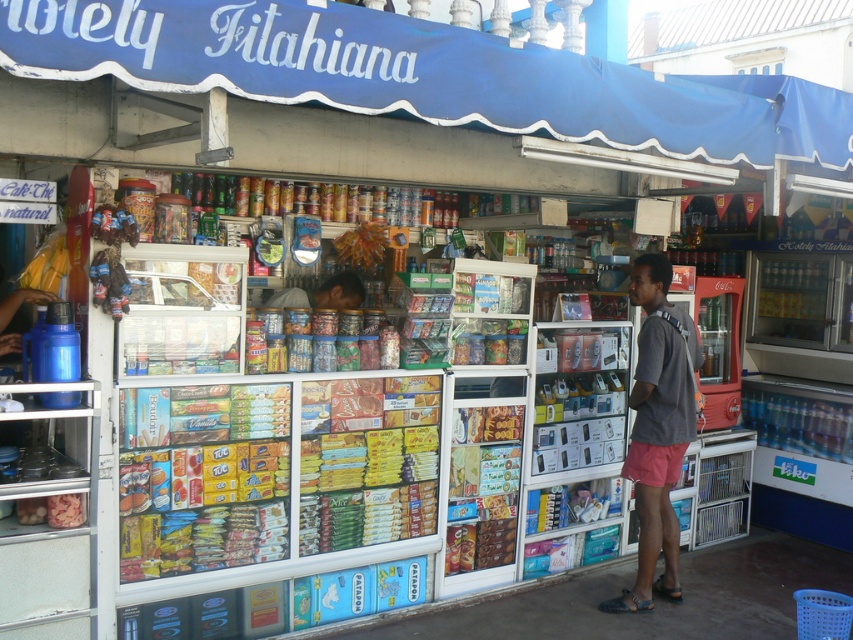
You are a customer at the Fitahiana street stall and you see the gray fabric shirt at center and the matte brown bag at center. Which object is taller?

The gray fabric shirt at center is taller than the matte brown bag at center.

You are a customer at the Fitahiana street stall and want to place your matte brown bag at center next to your gray fabric shirt at center. Since both items are at the center, which one will you have to move to make space?

Since the gray fabric shirt at center is wider than the matte brown bag at center, you would need to move the gray fabric shirt at center to make space for the matte brown bag at center.